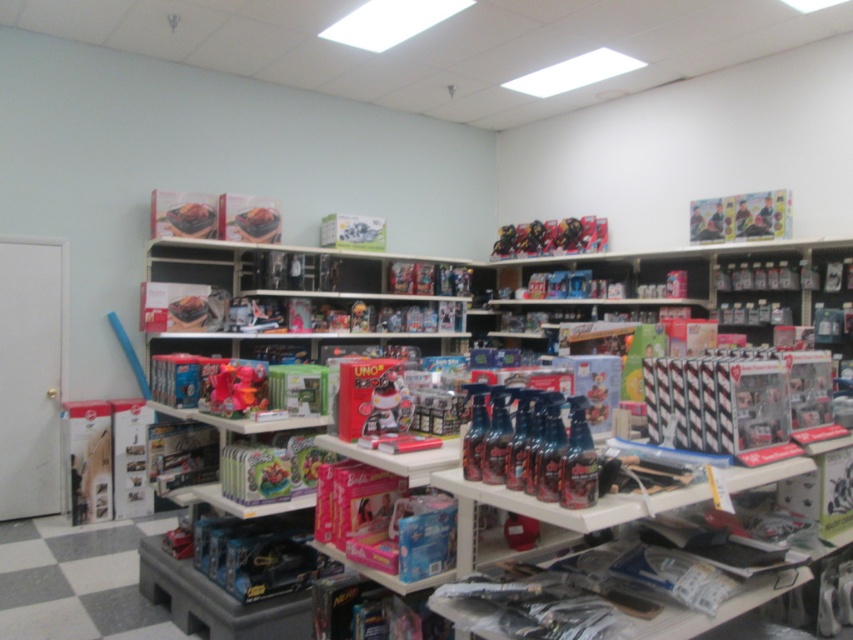
You are a delivery person who just arrived at the toy store. You need to place a large box that is 5 meters long in the empty space between the glossy plastic spray bottles at center and the mattel action figures at upper center. Will the box fit in that space?

The distance between the glossy plastic spray bottles at center and the mattel action figures at upper center is 4.60 meters. Since the box is 5 meters long, it will not fit in the space as it is longer than the available distance.